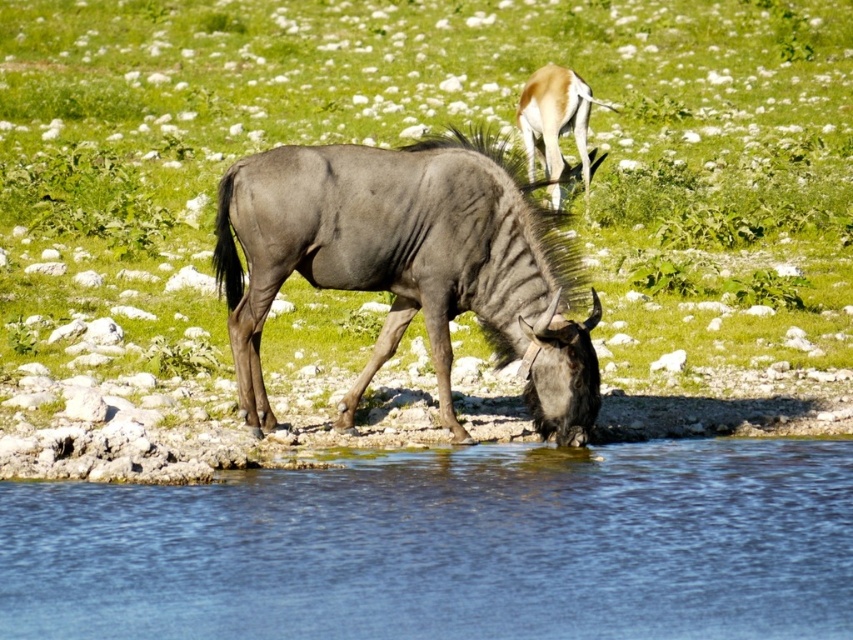
Question: Which point appears closest to the camera in this image?

Choices:
 (A) (x=579, y=138)
 (B) (x=357, y=260)
 (C) (x=706, y=120)
 (D) (x=723, y=586)

Answer: (D)

Question: Which of these objects is positioned closest to the transparent blue water at lower center?

Choices:
 (A) light brown fur antelope at upper center
 (B) gray matte/waxy wildebeest at center

Answer: (B)

Question: Which is farther from the gray matte/waxy wildebeest at center?

Choices:
 (A) green grass at center
 (B) light brown fur antelope at upper center

Answer: (A)

Question: Does green grass at center have a larger size compared to gray matte/waxy wildebeest at center?

Choices:
 (A) no
 (B) yes

Answer: (B)

Question: Can you confirm if transparent blue water at lower center is positioned below light brown fur antelope at upper center?

Choices:
 (A) no
 (B) yes

Answer: (B)

Question: Can you confirm if green grass at center is bigger than gray matte/waxy wildebeest at center?

Choices:
 (A) no
 (B) yes

Answer: (B)